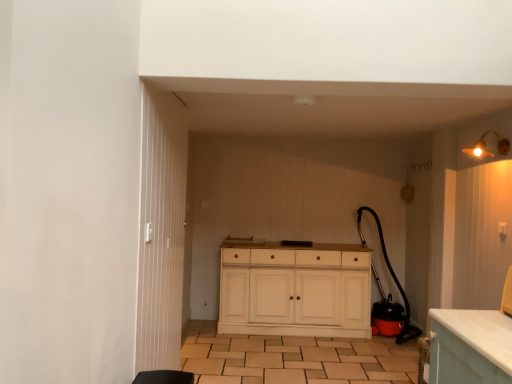
Question: Looking at the image, does white wood cabinet at center seem bigger or smaller compared to brown tile at center?

Choices:
 (A) big
 (B) small

Answer: (A)

Question: In terms of height, does white wood cabinet at center look taller or shorter compared to brown tile at center?

Choices:
 (A) short
 (B) tall

Answer: (B)

Question: Considering the real-world distances, which object is closest to the matte gold light fixture at upper right?

Choices:
 (A) white wood cabinet at center
 (B) brown tile at center
 (C) white wooden door at center

Answer: (A)

Question: Which is farther from the white wooden door at center?

Choices:
 (A) white wood cabinet at center
 (B) brown tile at center
 (C) matte gold light fixture at upper right

Answer: (C)